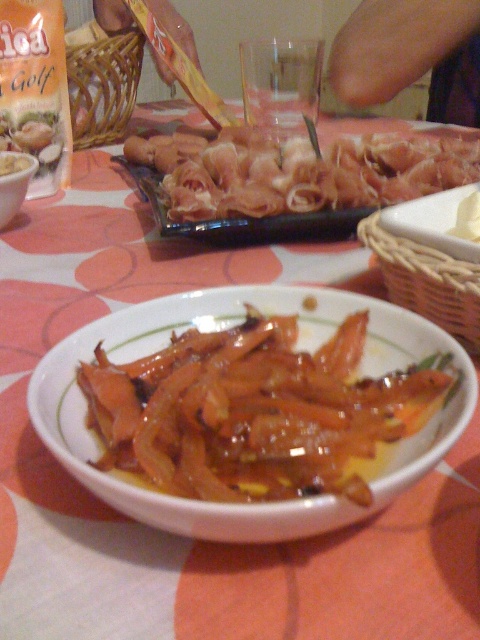
What object is located at the coordinates point (254, 412)?

The point (254, 412) is on glossy glazed carrots at center.

You are a chef preparing a dish and need to know which item is thinner between the glossy glazed carrots at center and the pinkish glossy meat at center. Can you tell me?

The glossy glazed carrots at center is thinner than the pinkish glossy meat at center according to the description.